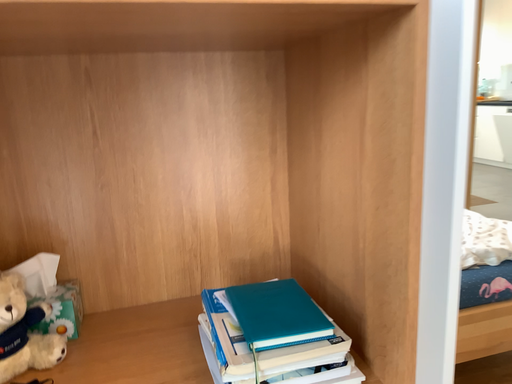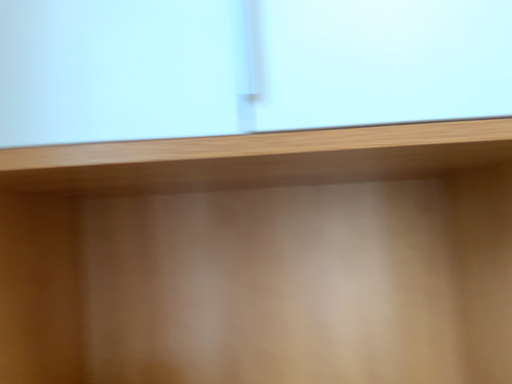
Question: Which way did the camera rotate in the video?

Choices:
 (A) rotated downward
 (B) rotated upward

Answer: (B)